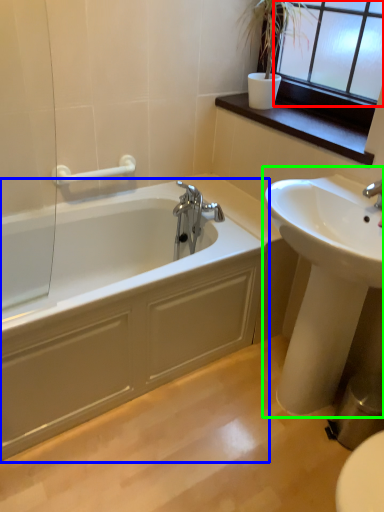
Question: Estimate the real-world distances between objects in this image. Which object is farther from window frame (highlighted by a red box), bathtub (highlighted by a blue box) or sink (highlighted by a green box)?

Choices:
 (A) bathtub
 (B) sink

Answer: (A)